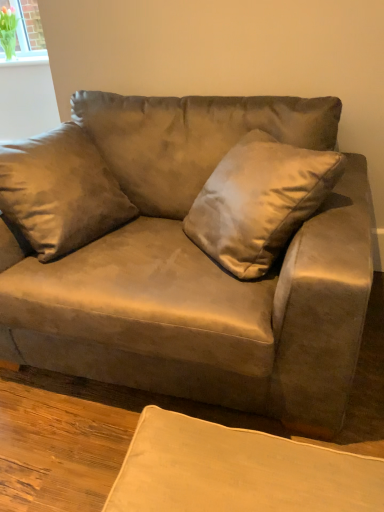
Question: From their relative heights in the image, would you say clear glass vase at upper left is taller or shorter than satin gold pillow at center?

Choices:
 (A) tall
 (B) short

Answer: (B)

Question: Is clear glass vase at upper left spatially inside satin gold pillow at center, or outside of it?

Choices:
 (A) inside
 (B) outside

Answer: (B)

Question: Estimate the real-world distances between objects in this image. Which object is closer to the suede couch at center?

Choices:
 (A) clear glass vase at upper left
 (B) satin gold pillow at center

Answer: (B)

Question: Estimate the real-world distances between objects in this image. Which object is farther from the clear glass vase at upper left?

Choices:
 (A) suede couch at center
 (B) satin gold pillow at center

Answer: (B)